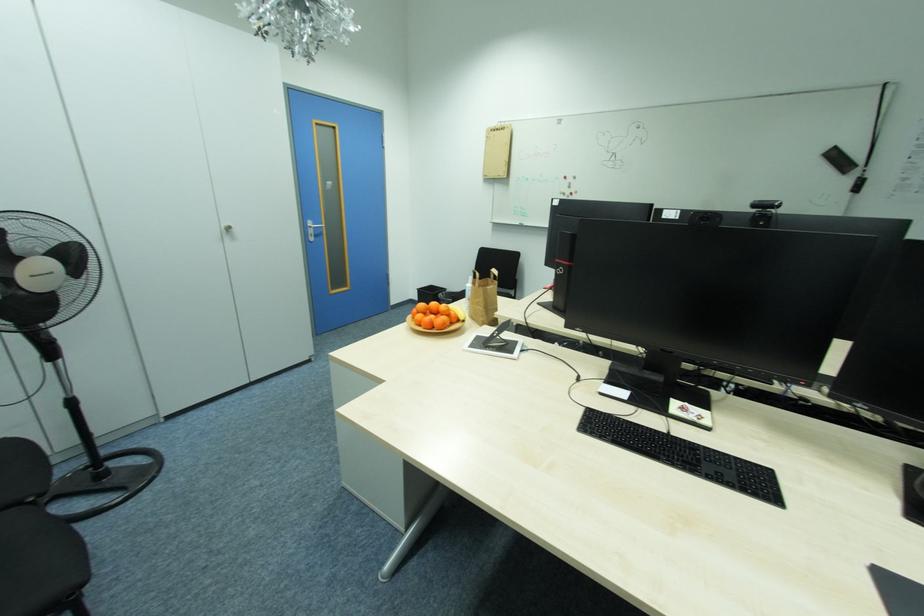
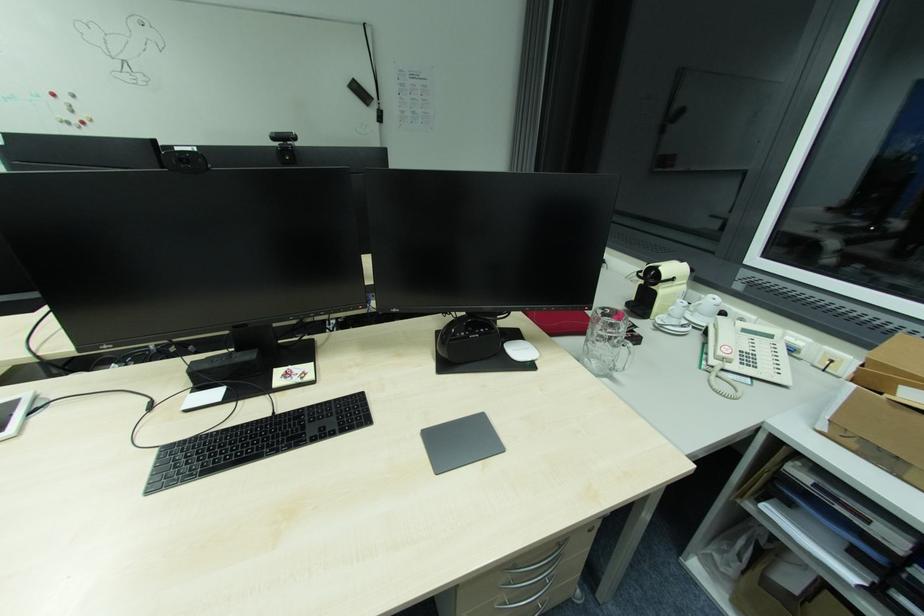
How did the camera likely rotate?

The camera rotated toward right-down.